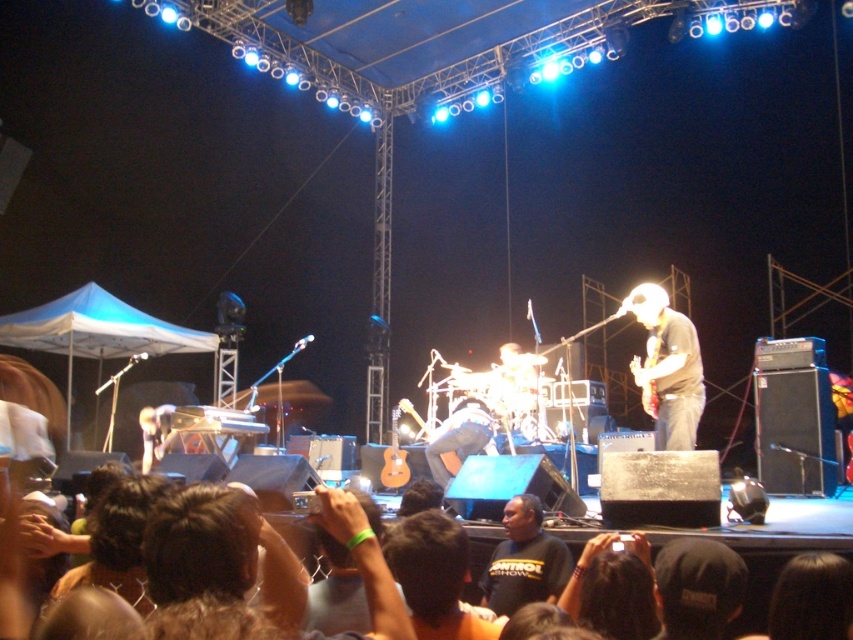
You are a photographer trying to capture a clear shot of the matte black guitar at center and the black cotton shirt at center during the concert. Since both are in the same area, will the guitar require more horizontal space in the frame compared to the shirt?

The matte black guitar at center might be wider than black cotton shirt at center, so it could require more horizontal space in the frame to fully capture both objects without cropping.

You are a stagehand who needs to place a new microphone stand at position point 0.5, 0.8. You see the matte black guitar at center. Will the microphone stand interfere with the guitar?

The matte black guitar at center is located at point (666, 368), so the microphone stand at (682, 320) is close but not directly overlapping. However, since the guitar is at center, it might still be in the way depending on the space. Check the exact placement for clearance.

In the scene shown: You are a photographer at the concert and want to capture a photo of both the matte black guitar at center and the black cotton shirt at center in the same frame. Based on their positions, which object should you focus on first to ensure both are in the frame?

The matte black guitar at center is to the right of the black cotton shirt at center, so you should focus on the black cotton shirt at center first to ensure both are in the frame.